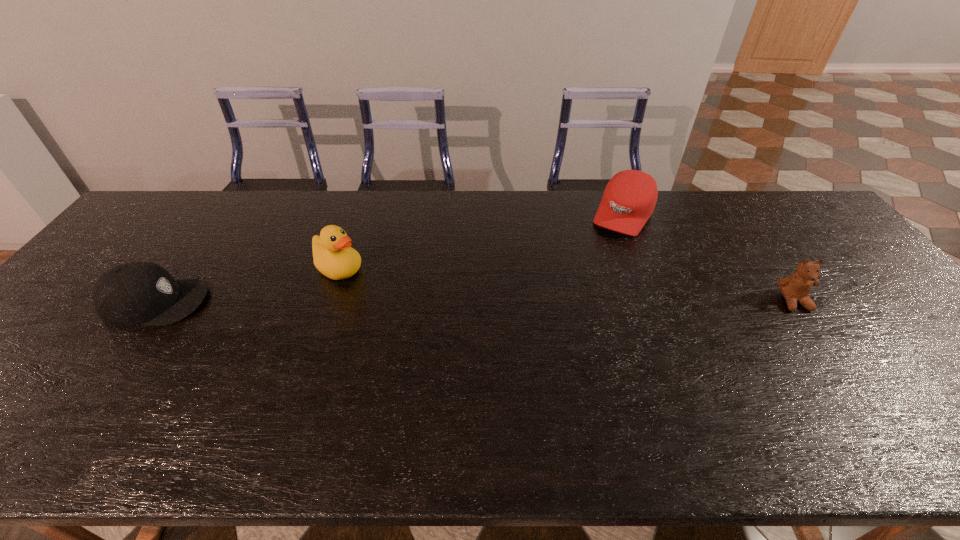
Find the location of a particular element. The height and width of the screenshot is (540, 960). free space on the desktop that is between the leftmost object and the teddy bear and is positioned at the beak of the tallest object is located at coordinates (401, 302).

Find the location of a particular element. vacant space on the desktop that is between the nearer cap and the teddy bear and is positioned on the front-facing side of the farthest object is located at coordinates (570, 302).